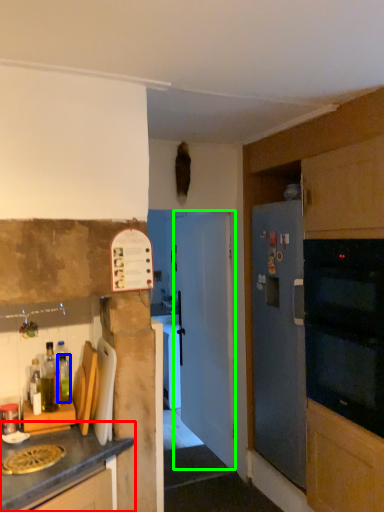
Question: Estimate the real-world distances between objects in this image. Which object is farther from cabinetry (highlighted by a red box), bottle (highlighted by a blue box) or door (highlighted by a green box)?

Choices:
 (A) bottle
 (B) door

Answer: (B)